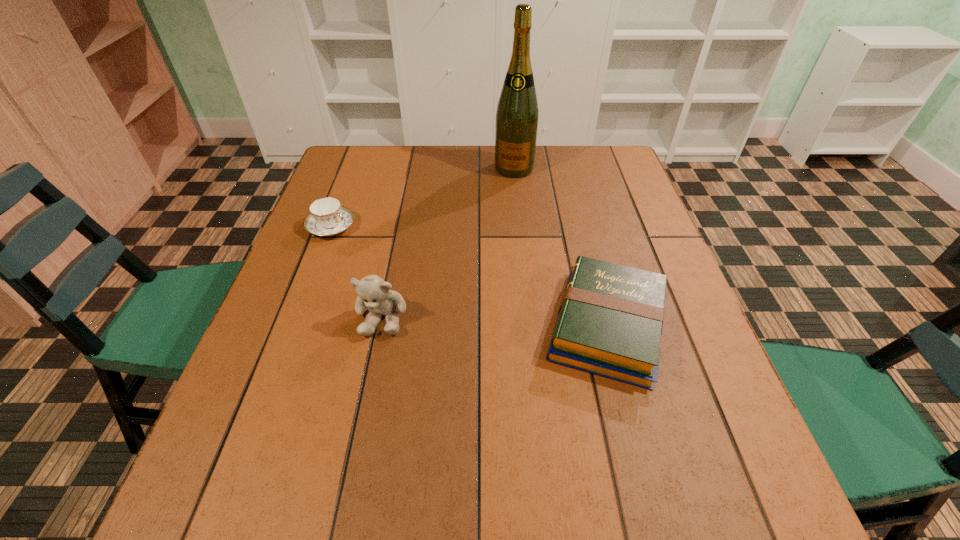
Locate an element on the screen. The image size is (960, 540). free space on the desktop that is between the teddy bear and the book and is positioned on the front-facing side of the wine bottle is located at coordinates (481, 321).

You are a GUI agent. You are given a task and a screenshot of the screen. Output one action in this format:
    pyautogui.click(x=<x>, y=<y>)
    Task: Click on the free space on the desktop that is between the second tallest object and the book and is positioned on the side with the handle of the leftmost object
    This screenshot has width=960, height=540.
    Given the screenshot: What is the action you would take?
    pyautogui.click(x=516, y=322)